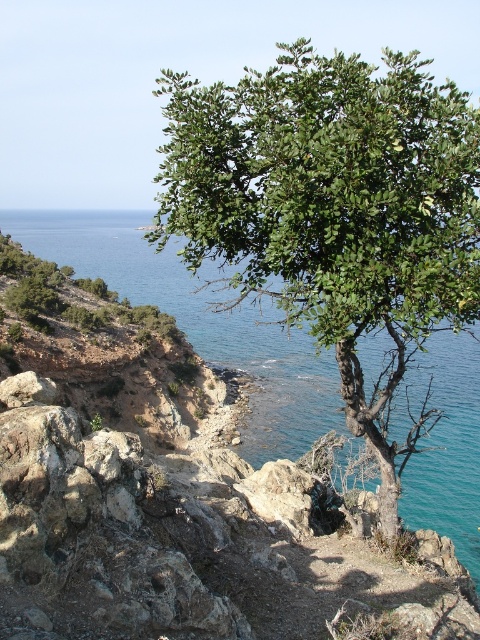
Image resolution: width=480 pixels, height=640 pixels. I want to click on green leafy tree at upper center, so click(334, 212).

Does point (191, 168) lie in front of point (335, 376)?

Yes.

At what (x,y) coordinates should I click in order to perform the action: click on green leafy tree at upper center. Please return your answer as a coordinate pair (x, y). This screenshot has width=480, height=640. Looking at the image, I should click on (334, 212).

Identify the location of green leafy tree at upper center. (334, 212).